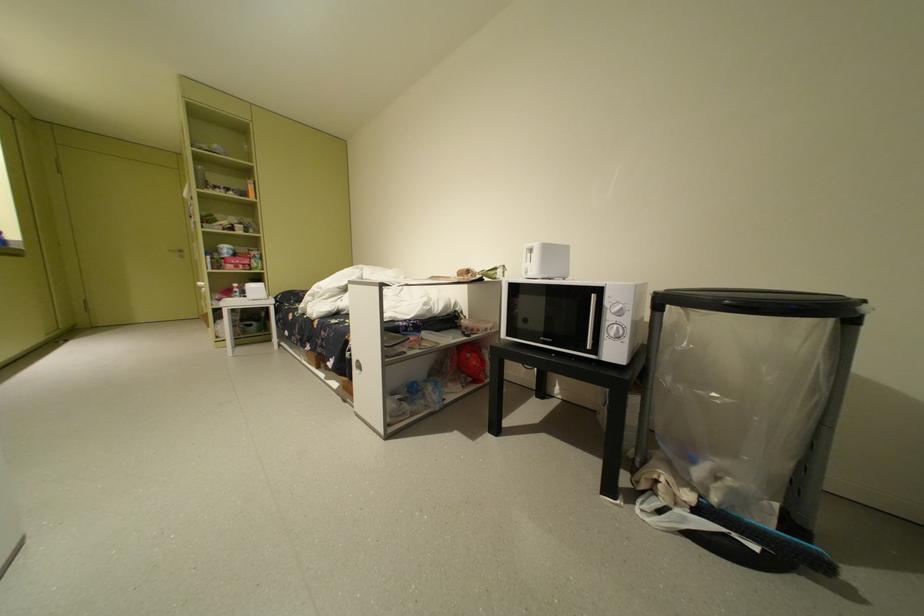
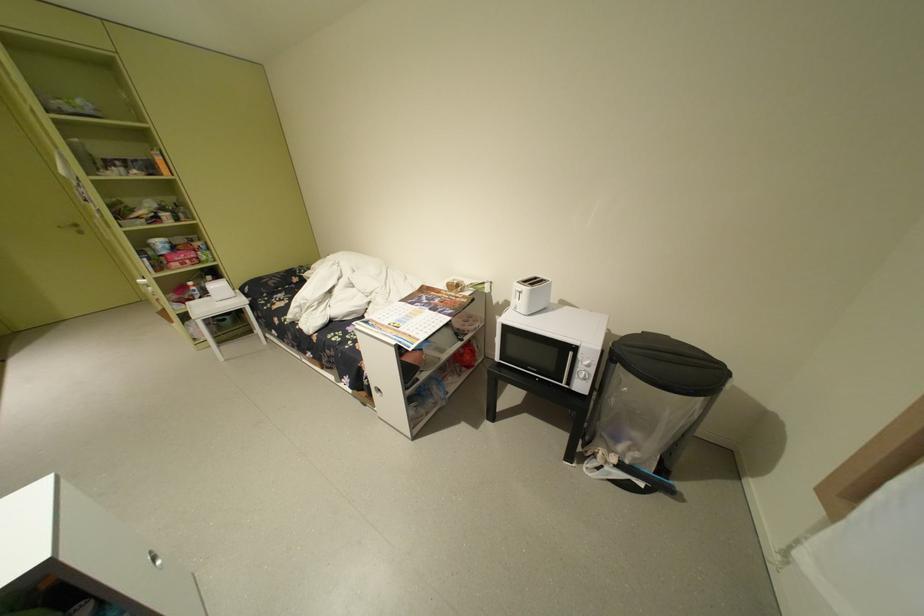
Locate, in the second image, the point that corresponds to (669,314) in the first image.

(624, 365)